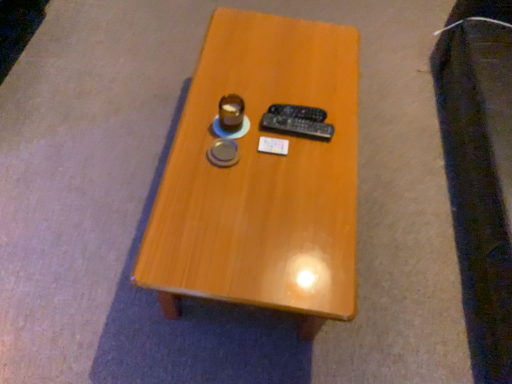
Question: From the image's perspective, is black plastic remote control at center, marked as the second remote control in a front-to-back arrangement, positioned above or below matte brown coffee cup at center?

Choices:
 (A) above
 (B) below

Answer: (A)

Question: Would you say black plastic remote control at center, arranged as the 1th remote control when viewed from the back, is inside or outside matte brown coffee cup at center?

Choices:
 (A) outside
 (B) inside

Answer: (A)

Question: Considering the real-world distances, which object is farthest from the matte brown coffee cup at center?

Choices:
 (A) black plastic remote control at center, marked as the second remote control in a front-to-back arrangement
 (B) black plastic remote control at center, arranged as the first remote control when viewed from the front
 (C) wooden table at center

Answer: (C)

Question: Estimate the real-world distances between objects in this image. Which object is farther from the black plastic remote control at center, arranged as the 1th remote control when viewed from the back?

Choices:
 (A) wooden table at center
 (B) black plastic remote control at center, arranged as the first remote control when viewed from the front
 (C) matte brown coffee cup at center

Answer: (A)